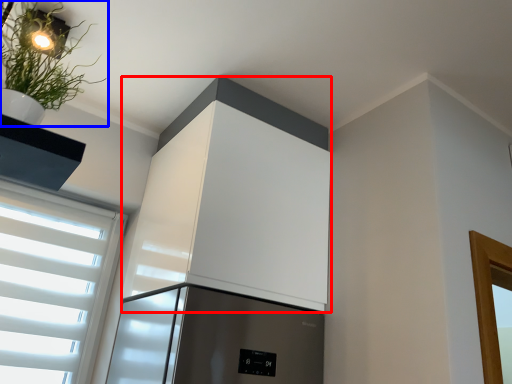
Question: Which point is further to the camera, appliance (highlighted by a red box) or houseplant (highlighted by a blue box)?

Choices:
 (A) appliance
 (B) houseplant

Answer: (A)